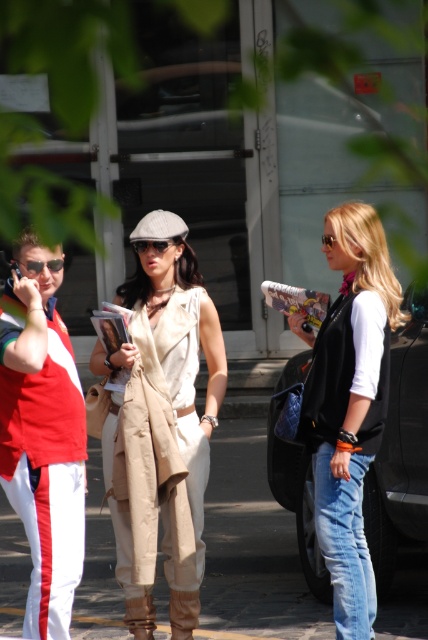
Is point (145, 337) in front of point (154, 244)?

Yes, it is.

Looking at this image, is beige fabric dress at center above matte black sunglasses at center?

Actually, beige fabric dress at center is below matte black sunglasses at center.

Is point (196, 444) positioned in front of point (157, 244)?

No, it is behind (157, 244).

In order to click on beige fabric dress at center in this screenshot , I will do `click(157, 456)`.

Can you confirm if beige fabric dress at center is smaller than black glossy car at center?

Indeed, beige fabric dress at center has a smaller size compared to black glossy car at center.

Between beige fabric dress at center and black glossy car at center, which one is positioned lower?

black glossy car at center

This screenshot has height=640, width=428. I want to click on beige fabric dress at center, so click(157, 456).

At what (x,y) coordinates should I click in order to perform the action: click on beige fabric dress at center. Please return your answer as a coordinate pair (x, y). This screenshot has height=640, width=428. Looking at the image, I should click on (157, 456).

Is point (152, 244) in front of point (35, 260)?

No, it is not.

Who is lower down, matte black sunglasses at center or matte black sunglasses at left?

Positioned lower is matte black sunglasses at left.

You are a GUI agent. You are given a task and a screenshot of the screen. Output one action in this format:
    pyautogui.click(x=<x>, y=<y>)
    Task: Click on the matte black sunglasses at center
    
    Given the screenshot: What is the action you would take?
    pyautogui.click(x=151, y=244)

Locate an element on the screen. Image resolution: width=428 pixels, height=640 pixels. matte black sunglasses at center is located at coordinates (151, 244).